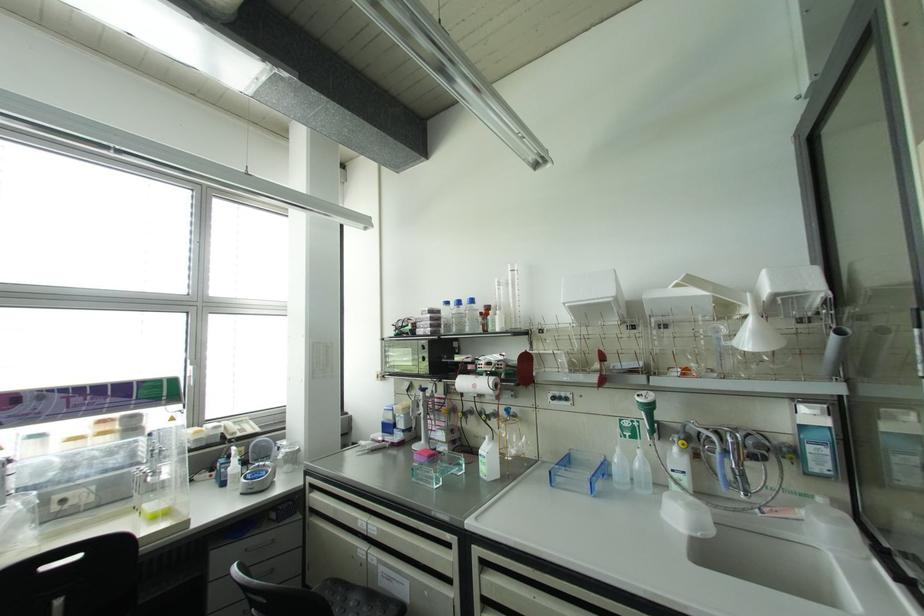
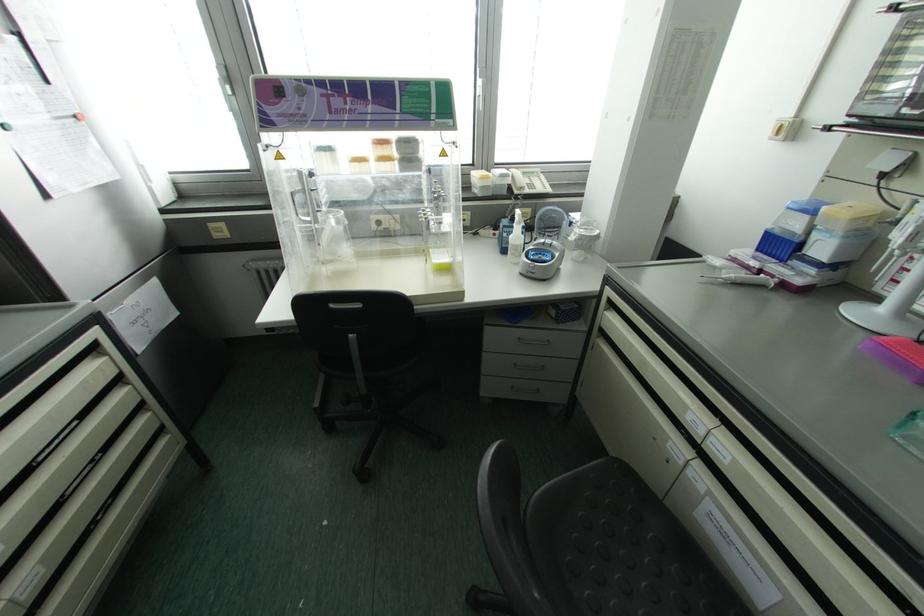
Where in the second image is the point corresponding to pixel 234 466 from the first image?

(516, 235)